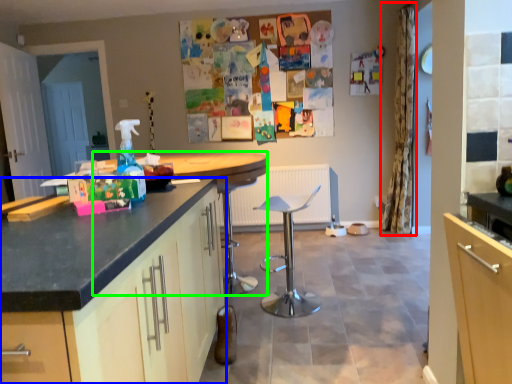
Question: Which is nearer to the curtain (highlighted by a red box)? cabinetry (highlighted by a blue box) or round table (highlighted by a green box).

Choices:
 (A) cabinetry
 (B) round table

Answer: (B)